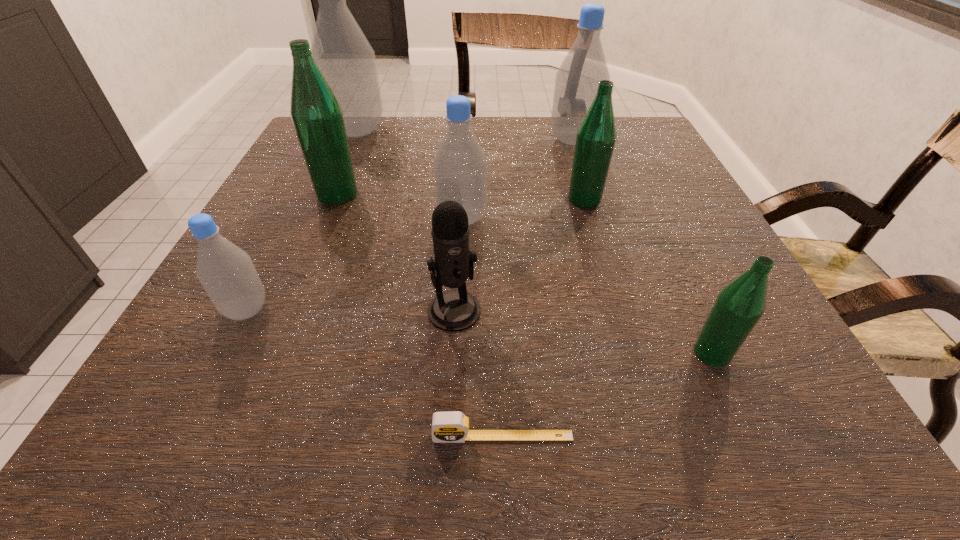
You are a GUI agent. You are given a task and a screenshot of the screen. Output one action in this format:
    pyautogui.click(x=<x>, y=<y>)
    Task: Click on the tallest bottle
    
    Given the screenshot: What is the action you would take?
    pyautogui.click(x=340, y=49)

Find the location of `the biggest gray bottle`. the biggest gray bottle is located at coordinates (340, 49).

Identify the location of the second biggest gray bottle. point(576,82).

The width and height of the screenshot is (960, 540). Identify the location of the biggest green bottle. (316, 113).

At what (x,y) coordinates should I click in order to perform the action: click on the second biggest green bottle. Please return your answer as a coordinate pair (x, y). The height and width of the screenshot is (540, 960). Looking at the image, I should click on (596, 136).

Find the location of a particular element. The height and width of the screenshot is (540, 960). the third biggest gray bottle is located at coordinates (460, 165).

Where is `the fourth bottle from right to left`? Image resolution: width=960 pixels, height=540 pixels. the fourth bottle from right to left is located at coordinates (460, 165).

This screenshot has width=960, height=540. Identify the location of black microphone. (456, 310).

The height and width of the screenshot is (540, 960). What are the coordinates of `the smallest gray bottle` in the screenshot? It's located at (226, 272).

The width and height of the screenshot is (960, 540). In order to click on the second nearest bottle in this screenshot , I will do `click(226, 272)`.